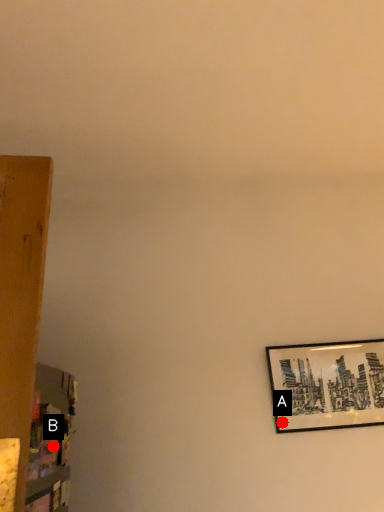
Question: Two points are circled on the image, labeled by A and B beside each circle. Which point appears closest to the camera in this image?

Choices:
 (A) A is closer
 (B) B is closer

Answer: (B)